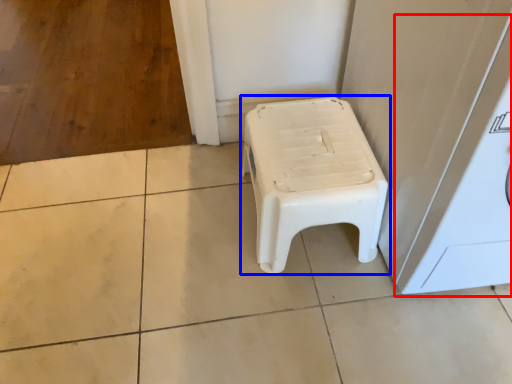
Question: Which of the following is the closest to the observer, washing machine (highlighted by a red box) or stool (highlighted by a blue box)?

Choices:
 (A) washing machine
 (B) stool

Answer: (A)